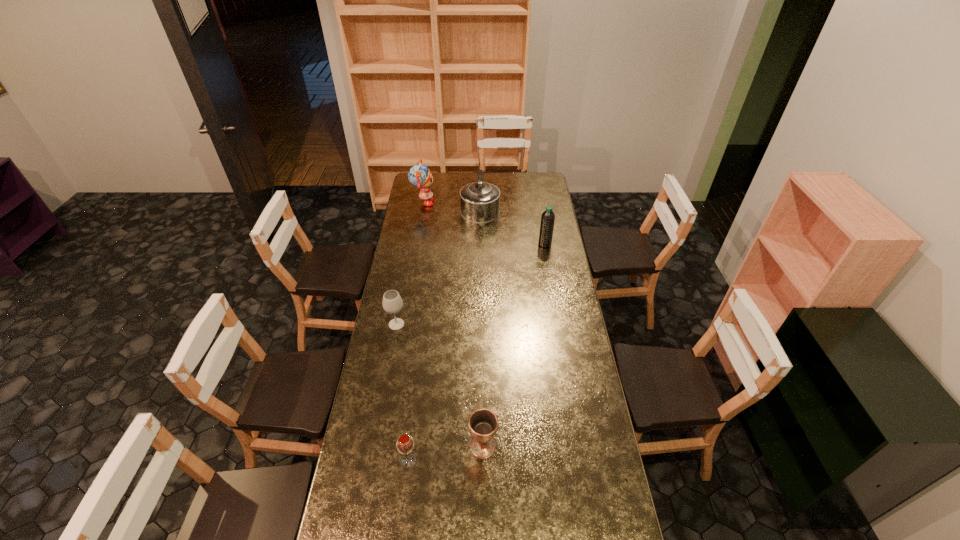
Where is `free space between the shorter wineglass and the fourth farthest object`? This screenshot has width=960, height=540. free space between the shorter wineglass and the fourth farthest object is located at coordinates (403, 393).

This screenshot has width=960, height=540. What are the coordinates of `the second closest object to the doll` in the screenshot? It's located at (548, 217).

At what (x,y) coordinates should I click in order to perform the action: click on object that is the fourth nearest to the doll. Please return your answer as a coordinate pair (x, y). Image resolution: width=960 pixels, height=540 pixels. Looking at the image, I should click on (483, 423).

This screenshot has width=960, height=540. Identify the location of vacant space that satisfies the following two spatial constraints: 1. on the face of the doll; 2. on the left side of the chalice. (382, 446).

At what (x,y) coordinates should I click in order to perform the action: click on free spot that satisfies the following two spatial constraints: 1. on the face of the nearer wineglass; 2. on the left side of the doll. Please return your answer as a coordinate pair (x, y). The width and height of the screenshot is (960, 540). Looking at the image, I should click on (380, 461).

You are a GUI agent. You are given a task and a screenshot of the screen. Output one action in this format:
    pyautogui.click(x=<x>, y=<y>)
    Task: Click on the vacant space that satisfies the following two spatial constraints: 1. on the face of the water bottle; 2. on the left side of the doll
    The image size is (960, 540).
    Given the screenshot: What is the action you would take?
    pyautogui.click(x=417, y=244)

Where is `free space that satisfies the following two spatial constraints: 1. on the back side of the chalice; 2. on the face of the doll`? free space that satisfies the following two spatial constraints: 1. on the back side of the chalice; 2. on the face of the doll is located at coordinates (482, 203).

Where is `vacant region that satisfies the following two spatial constraints: 1. on the back side of the water bottle; 2. on the right side of the right wineglass`? This screenshot has width=960, height=540. vacant region that satisfies the following two spatial constraints: 1. on the back side of the water bottle; 2. on the right side of the right wineglass is located at coordinates (435, 244).

You are a GUI agent. You are given a task and a screenshot of the screen. Output one action in this format:
    pyautogui.click(x=<x>, y=<y>)
    Task: Click on the vacant region that satisfies the following two spatial constraints: 1. on the front side of the fourth farthest object; 2. on the left side of the chalice
    
    Given the screenshot: What is the action you would take?
    pyautogui.click(x=374, y=446)